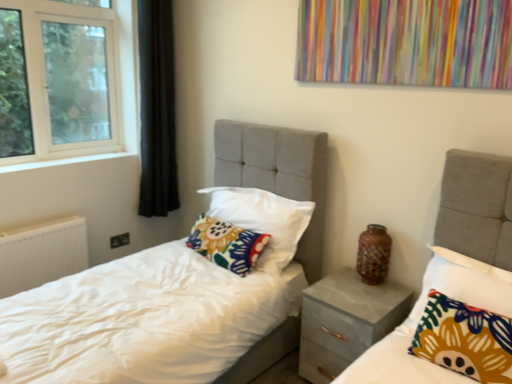
Question: Looking at the image, does floral fabric pillow at center, which appears as the first pillow when viewed from the back, seem bigger or smaller compared to white textured radiator at lower left?

Choices:
 (A) big
 (B) small

Answer: (A)

Question: Would you say floral fabric pillow at center, which is the 3th pillow from front to back, is to the left or to the right of white textured radiator at lower left in the picture?

Choices:
 (A) right
 (B) left

Answer: (A)

Question: Which object is the closest to the shiny mosaic vase at center?

Choices:
 (A) floral fabric pillow at center, which is the 3th pillow from front to back
 (B) matte gray nightstand at center
 (C) white textured radiator at lower left
 (D) floral fabric pillow at center, arranged as the 1th pillow when viewed from the front
 (E) floral fabric pillow at center, the 2th pillow from the back

Answer: (B)

Question: Which object is positioned farthest from the floral fabric pillow at center, which appears as the first pillow when viewed from the back?

Choices:
 (A) floral fabric pillow at center, which appears as the 3th pillow when viewed from the back
 (B) matte gray nightstand at center
 (C) white textured radiator at lower left
 (D) shiny mosaic vase at center
 (E) floral fabric pillow at center, positioned as the 2th pillow in front-to-back order

Answer: (A)